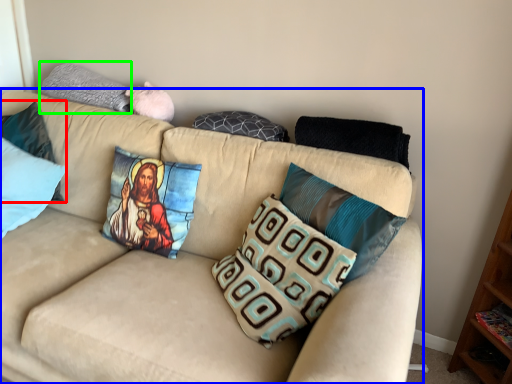
Question: Which object is positioned closest to pillow (highlighted by a red box)? Select from studio couch (highlighted by a blue box) and pillow (highlighted by a green box).

Choices:
 (A) studio couch
 (B) pillow

Answer: (B)